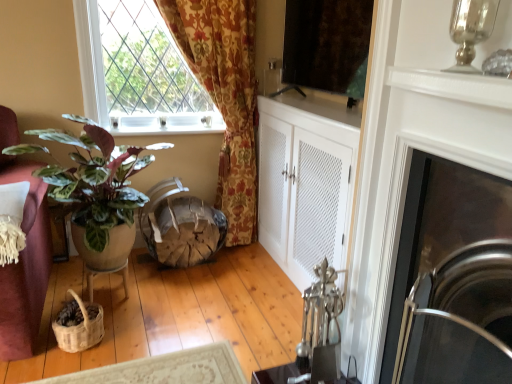
Question: Is polished stainless steel fireplace at right to the left of wooden table at lower left from the viewer's perspective?

Choices:
 (A) no
 (B) yes

Answer: (A)

Question: From a real-world perspective, is polished stainless steel fireplace at right physically below wooden table at lower left?

Choices:
 (A) no
 (B) yes

Answer: (A)

Question: Considering the relative sizes of polished stainless steel fireplace at right and wooden table at lower left in the image provided, is polished stainless steel fireplace at right wider than wooden table at lower left?

Choices:
 (A) yes
 (B) no

Answer: (A)

Question: From a real-world perspective, is polished stainless steel fireplace at right on wooden table at lower left?

Choices:
 (A) no
 (B) yes

Answer: (B)

Question: Does polished stainless steel fireplace at right turn towards wooden table at lower left?

Choices:
 (A) yes
 (B) no

Answer: (B)

Question: Is wooden textured swivel chair at center spatially inside wooden table at lower left, or outside of it?

Choices:
 (A) inside
 (B) outside

Answer: (B)

Question: Considering their positions, is wooden textured swivel chair at center located in front of or behind wooden table at lower left?

Choices:
 (A) front
 (B) behind

Answer: (B)

Question: From the image's perspective, is wooden textured swivel chair at center positioned above or below wooden table at lower left?

Choices:
 (A) above
 (B) below

Answer: (A)

Question: Is wooden textured swivel chair at center bigger or smaller than wooden table at lower left?

Choices:
 (A) big
 (B) small

Answer: (A)

Question: Considering their positions, is wooden table at lower left located in front of or behind wooden textured swivel chair at center?

Choices:
 (A) behind
 (B) front

Answer: (B)

Question: Would you say wooden table at lower left is to the left or to the right of wooden textured swivel chair at center in the picture?

Choices:
 (A) left
 (B) right

Answer: (A)

Question: From a real-world perspective, is wooden table at lower left physically located above or below wooden textured swivel chair at center?

Choices:
 (A) above
 (B) below

Answer: (B)

Question: Is wooden table at lower left inside or outside of wooden textured swivel chair at center?

Choices:
 (A) inside
 (B) outside

Answer: (B)

Question: Choose the correct answer: Is matte black screen at upper center inside wooden table at lower left or outside it?

Choices:
 (A) inside
 (B) outside

Answer: (B)

Question: Considering the positions of matte black screen at upper center and wooden table at lower left in the image, is matte black screen at upper center bigger or smaller than wooden table at lower left?

Choices:
 (A) small
 (B) big

Answer: (B)